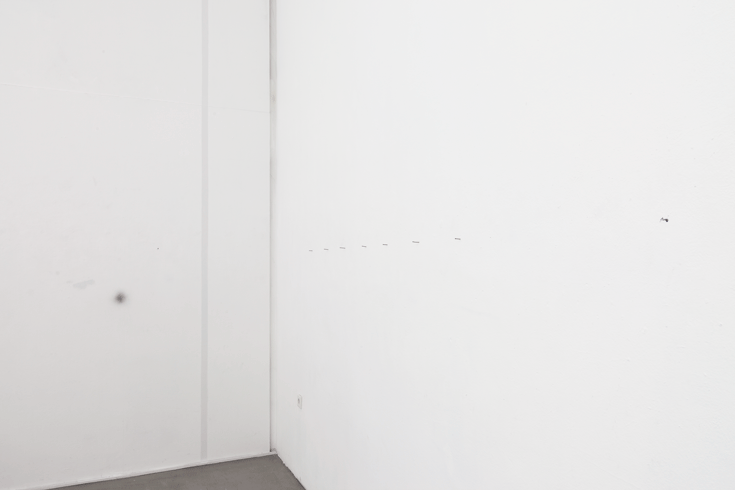
The height and width of the screenshot is (490, 735). I want to click on wall, so click(x=491, y=341), click(x=118, y=200).